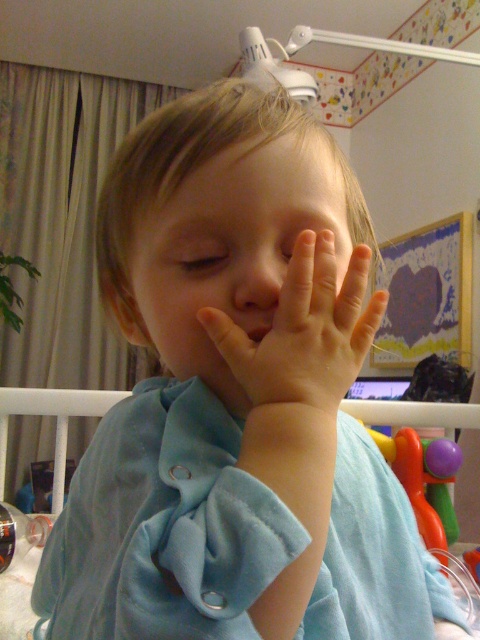
Can you confirm if smooth skin face at center is thinner than blue soft fabric infant bed at center?

Correct, smooth skin face at center's width is less than blue soft fabric infant bed at center's.

Locate an element on the screen. The image size is (480, 640). smooth skin face at center is located at coordinates (232, 248).

This screenshot has height=640, width=480. Find the location of `smooth skin face at center`. smooth skin face at center is located at coordinates (232, 248).

Can you confirm if smooth skin face at center is positioned below smooth flesh hand at center?

Incorrect, smooth skin face at center is not positioned below smooth flesh hand at center.

Who is positioned more to the right, smooth skin face at center or smooth flesh hand at center?

Positioned to the right is smooth flesh hand at center.

At what (x,y) coordinates should I click in order to perform the action: click on smooth skin face at center. Please return your answer as a coordinate pair (x, y). Image resolution: width=480 pixels, height=640 pixels. Looking at the image, I should click on (232, 248).

Which is below, smooth flesh hand at center or blue soft fabric infant bed at center?

blue soft fabric infant bed at center

What do you see at coordinates (303, 333) in the screenshot? I see `smooth flesh hand at center` at bounding box center [303, 333].

Locate an element on the screen. The image size is (480, 640). smooth flesh hand at center is located at coordinates (303, 333).